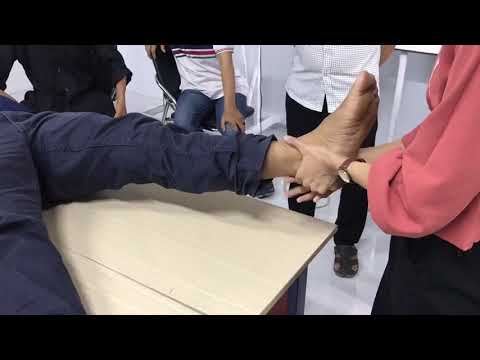
Image resolution: width=480 pixels, height=360 pixels. I want to click on table, so click(x=142, y=229).